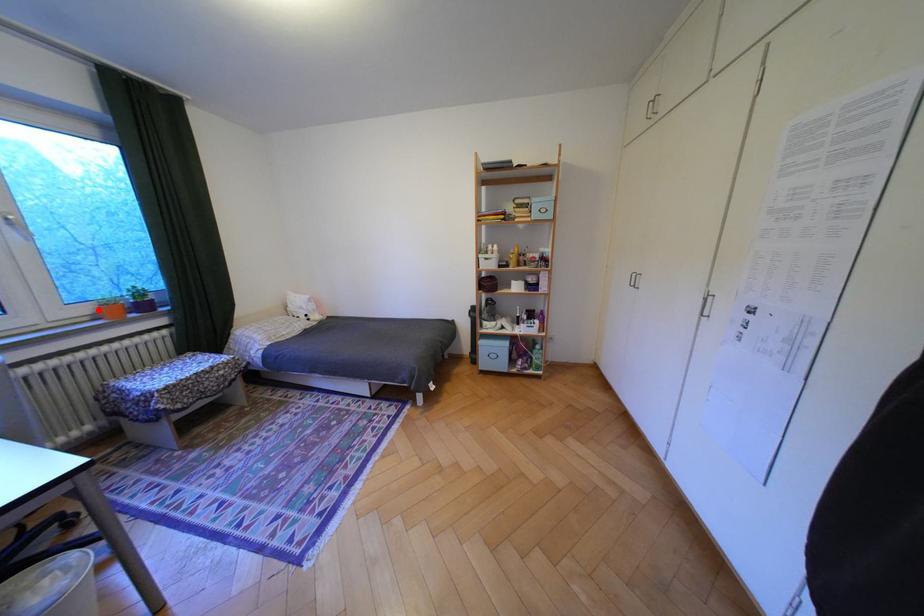
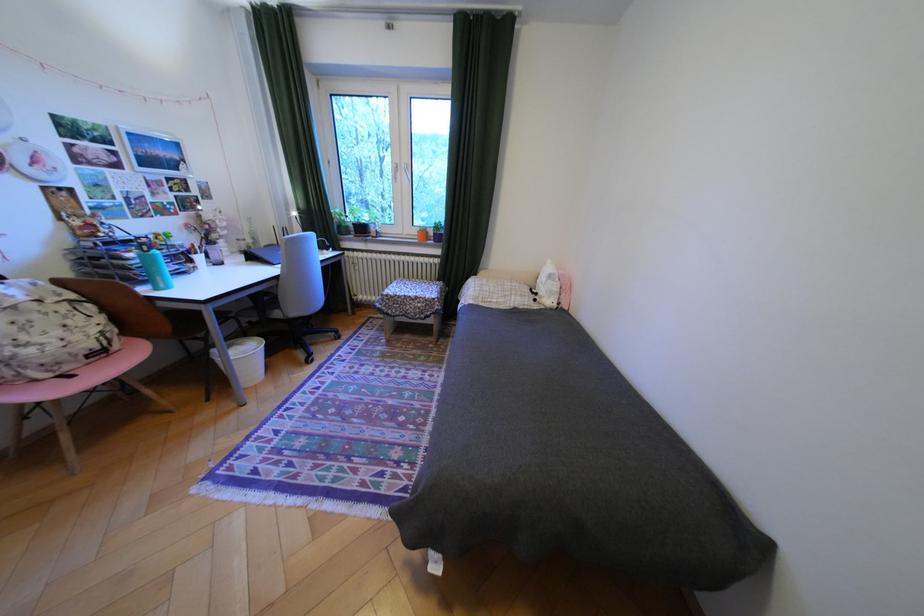
Locate, in the second image, the point that corresponds to the highlighted location in the first image.

(427, 232)